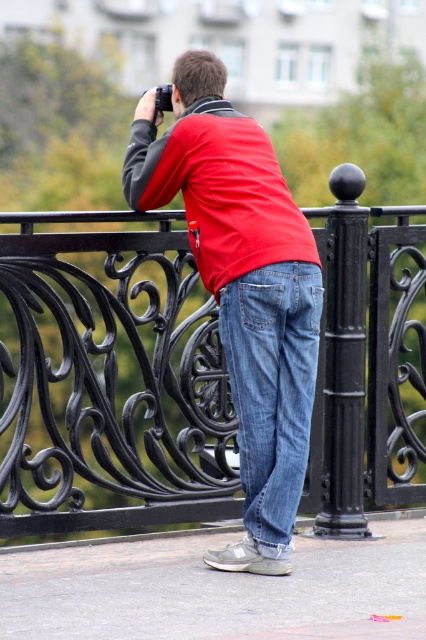
Question: Is matte red shirt at center below blue denim jeans at center?

Choices:
 (A) yes
 (B) no

Answer: (B)

Question: Estimate the real-world distances between objects in this image. Which object is farther from the matte red shirt at center?

Choices:
 (A) black wrought iron fence at center
 (B) blue denim jeans at center

Answer: (A)

Question: Which of the following is the farthest from the observer?

Choices:
 (A) (268, 396)
 (B) (333, 237)
 (C) (256, 257)

Answer: (B)

Question: Observing the image, what is the correct spatial positioning of matte red shirt at center in reference to blue denim jeans at center?

Choices:
 (A) below
 (B) above

Answer: (B)

Question: Can you confirm if black wrought iron fence at center is smaller than matte red shirt at center?

Choices:
 (A) yes
 (B) no

Answer: (B)

Question: Based on their relative distances, which object is farther from the black wrought iron fence at center?

Choices:
 (A) blue denim jeans at center
 (B) matte red shirt at center

Answer: (A)